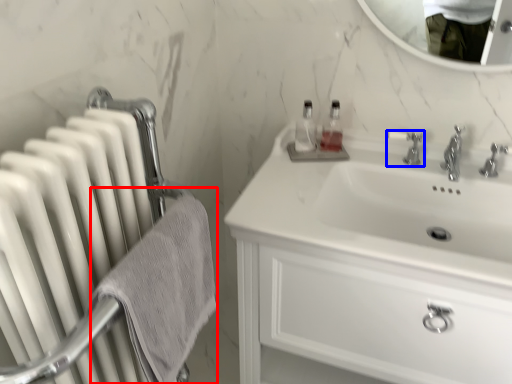
Question: Which point is closer to the camera, bath towel (highlighted by a red box) or tap (highlighted by a blue box)?

Choices:
 (A) bath towel
 (B) tap

Answer: (A)